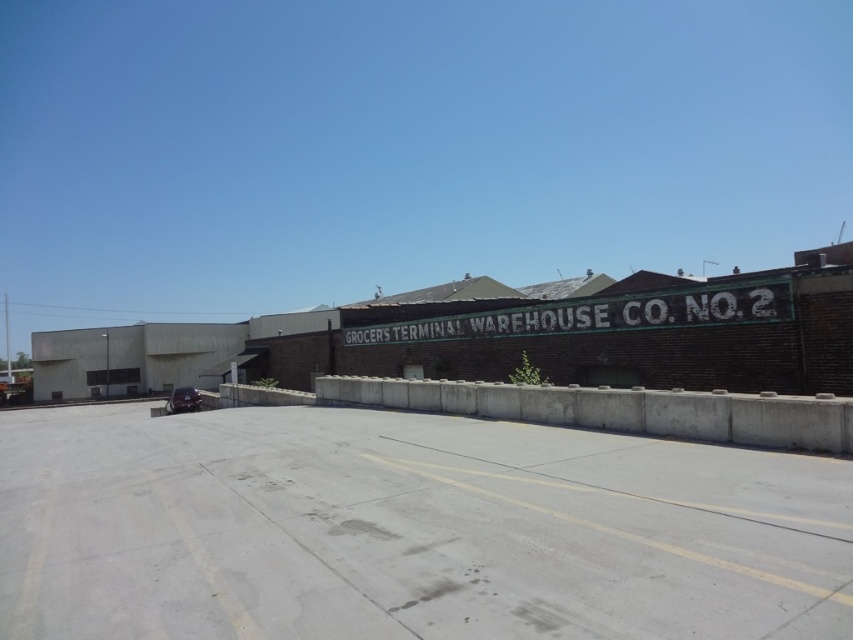
Question: Which object is farther from the camera taking this photo?

Choices:
 (A) white painted metal sign at center
 (B) shiny black car at lower left

Answer: (B)

Question: Which object appears farthest from the camera in this image?

Choices:
 (A) shiny black car at lower left
 (B) white painted metal sign at center

Answer: (A)

Question: Considering the relative positions of white painted metal sign at center and shiny black car at lower left in the image provided, where is white painted metal sign at center located with respect to shiny black car at lower left?

Choices:
 (A) above
 (B) below

Answer: (A)

Question: Which object is farther from the camera taking this photo?

Choices:
 (A) shiny black car at lower left
 (B) white painted metal sign at center

Answer: (A)

Question: In this image, where is white painted metal sign at center located relative to shiny black car at lower left?

Choices:
 (A) left
 (B) right

Answer: (B)

Question: Does white painted metal sign at center appear on the left side of shiny black car at lower left?

Choices:
 (A) yes
 (B) no

Answer: (B)